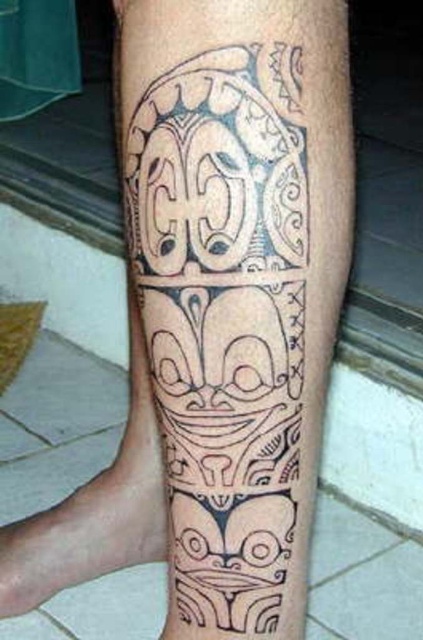
Question: Considering the relative positions of black ink tattoo at center and black ink tattoo at lower left in the image provided, where is black ink tattoo at center located with respect to black ink tattoo at lower left?

Choices:
 (A) left
 (B) right

Answer: (B)

Question: Does black ink tattoo at center appear under black ink tattoo at lower left?

Choices:
 (A) yes
 (B) no

Answer: (B)

Question: Does black ink tattoo at center lie behind black ink tattoo at lower left?

Choices:
 (A) yes
 (B) no

Answer: (B)

Question: Which object is farther from the camera taking this photo?

Choices:
 (A) black ink tattoo at lower left
 (B) black ink tattoo at center

Answer: (A)